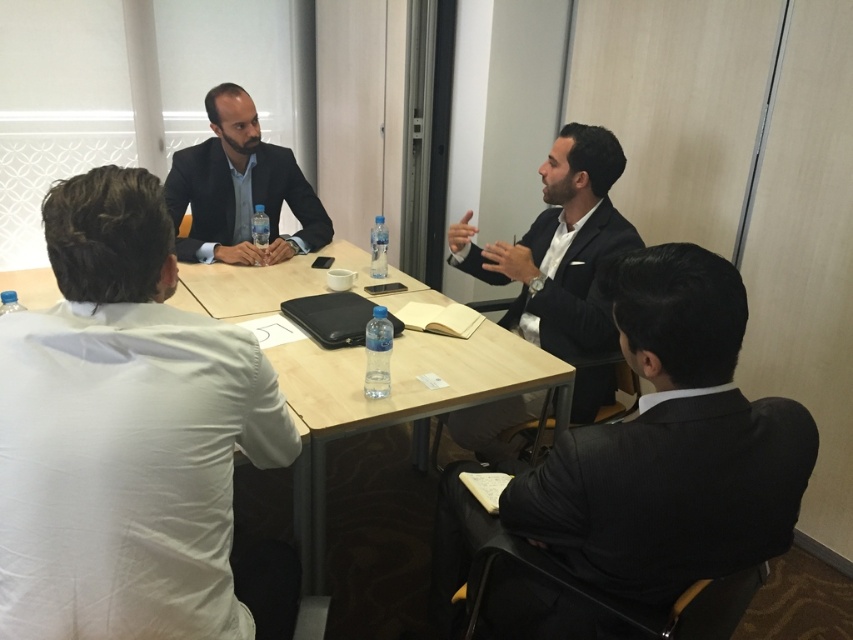
You are a photographer standing at the back of the conference room. You want to take a photo of both the black glossy suit at center and the matte black suit at center. The minimum distance your camera requires between subjects for clear focus is 3 feet. Can you capture both subjects in focus without moving either of them?

The black glossy suit at center is 3.30 feet from the matte black suit at center. Since the required minimum distance is 3 feet, the camera can capture both subjects in focus as the distance between them meets the requirement.